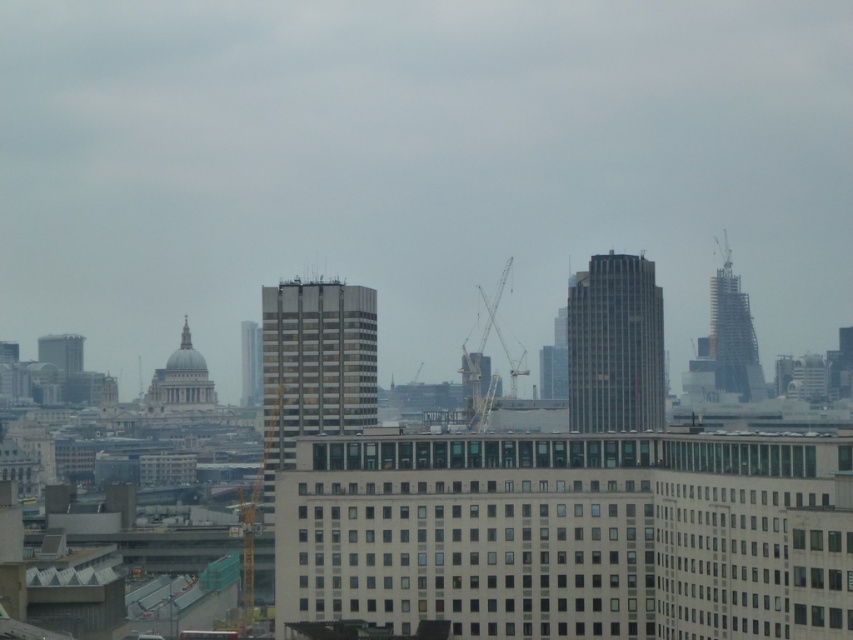
Who is positioned more to the right, white marble dome at center or metallic gray crane at center?

metallic gray crane at center is more to the right.

Is white marble dome at center taller than metallic gray crane at center?

In fact, white marble dome at center may be shorter than metallic gray crane at center.

Find the location of a particular element. white marble dome at center is located at coordinates (180, 380).

Is white marble dome at center taller than matte glass skyscraper at upper left?

Indeed, white marble dome at center has a greater height compared to matte glass skyscraper at upper left.

Is white marble dome at center further to the viewer compared to matte glass skyscraper at upper left?

No, white marble dome at center is in front of matte glass skyscraper at upper left.

Locate an element on the screen. This screenshot has width=853, height=640. white marble dome at center is located at coordinates (180, 380).

How distant is matte glass building at center from yellow metallic crane at center-left?

59.46 feet

Is matte glass building at center taller than yellow metallic crane at center-left?

Correct, matte glass building at center is much taller as yellow metallic crane at center-left.

The image size is (853, 640). I want to click on matte glass building at center, so click(317, 360).